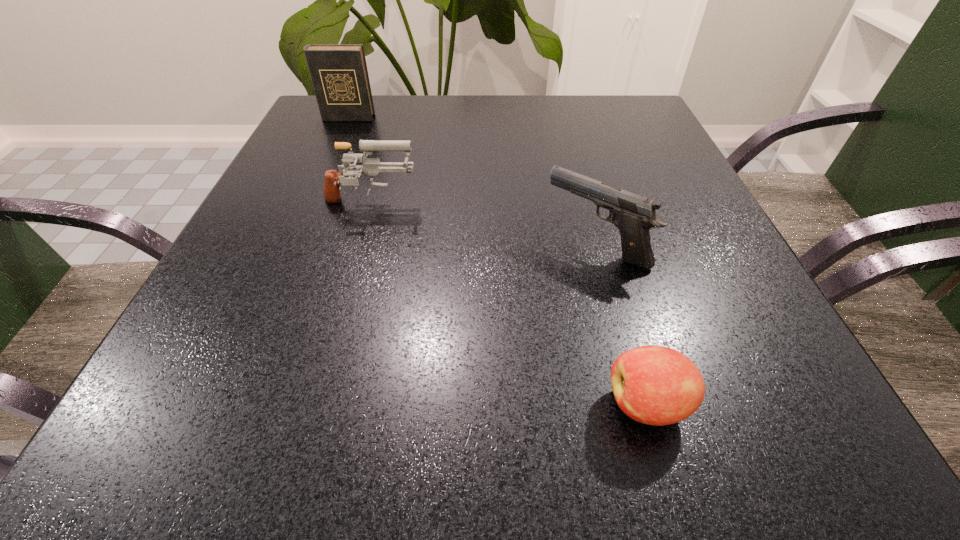
The width and height of the screenshot is (960, 540). Identify the location of blank region between the farthest object and the right gun. (471, 181).

Find the location of a particular element. vacant area between the right gun and the farthest object is located at coordinates (471, 181).

In order to click on free space between the shortest object and the right gun in this screenshot , I will do `click(621, 325)`.

I want to click on blank region between the nearest object and the left gun, so click(x=509, y=305).

Where is `object that is the closest to the farthest object`? The height and width of the screenshot is (540, 960). object that is the closest to the farthest object is located at coordinates (371, 166).

Identify which object is located as the third nearest to the shortest object. Please provide its 2D coordinates. Your answer should be formatted as a tuple, i.e. [(x, y)], where the tuple contains the x and y coordinates of a point satisfying the conditions above.

[(339, 74)]

This screenshot has height=540, width=960. What are the coordinates of `vacant position in the image that satisfies the following two spatial constraints: 1. at the barrel end of the nearest object; 2. on the left side of the left gun` in the screenshot? It's located at (314, 404).

Locate an element on the screen. Image resolution: width=960 pixels, height=540 pixels. vacant position in the image that satisfies the following two spatial constraints: 1. on the front cover of the tallest object; 2. on the right side of the shortest object is located at coordinates (222, 404).

You are a GUI agent. You are given a task and a screenshot of the screen. Output one action in this format:
    pyautogui.click(x=<x>, y=<y>)
    Task: Click on the free region that satisfies the following two spatial constraints: 1. at the barrel end of the left gun; 2. on the back side of the nearest object
    The width and height of the screenshot is (960, 540).
    Given the screenshot: What is the action you would take?
    pyautogui.click(x=314, y=404)

Find the location of `free space in the image that satisfies the following two spatial constraints: 1. at the muzzle of the right gun; 2. on the left side of the shortest object`. free space in the image that satisfies the following two spatial constraints: 1. at the muzzle of the right gun; 2. on the left side of the shortest object is located at coordinates (638, 404).